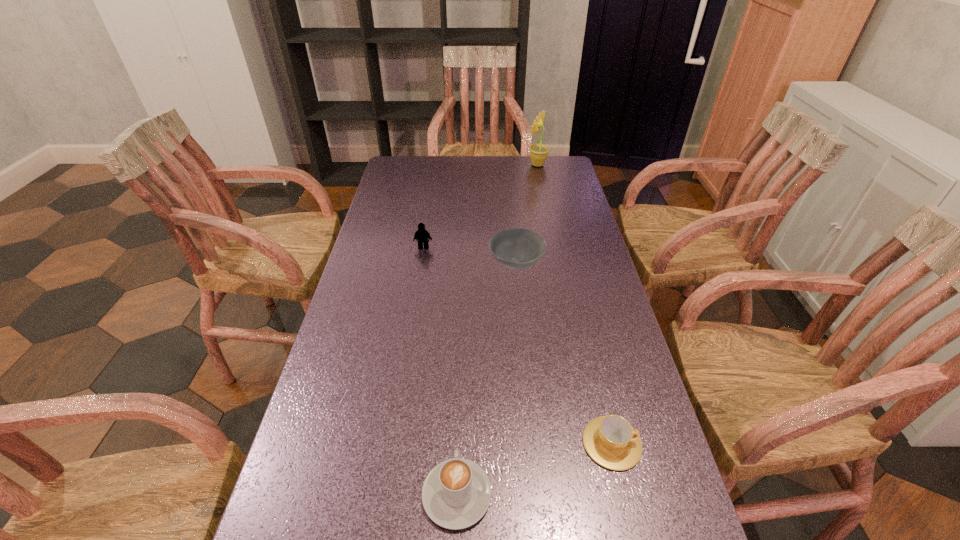
In the image, there is a desktop. Where is `vacant space at the left edge`? This screenshot has width=960, height=540. vacant space at the left edge is located at coordinates (310, 442).

Identify the location of vacant area at the right edge of the desktop. (659, 502).

Locate an element on the screen. This screenshot has height=540, width=960. free space at the far left corner of the desktop is located at coordinates (399, 171).

Locate an element on the screen. Image resolution: width=960 pixels, height=540 pixels. free space between the Lego and the farthest object is located at coordinates (481, 206).

At what (x,y) coordinates should I click in order to perform the action: click on vacant space in between the bowl and the farthest object. Please return your answer as a coordinate pair (x, y). Looking at the image, I should click on (527, 214).

Identify the location of free spot between the shortest object and the fourth object from right to left. (535, 469).

Locate an element on the screen. The height and width of the screenshot is (540, 960). vacant area that lies between the cup and the Lego is located at coordinates (517, 345).

Find the location of a particular element. Image resolution: width=960 pixels, height=540 pixels. free space between the cappuccino and the leftmost object is located at coordinates (441, 371).

Where is `free spot between the farthest object and the cappuccino`? Image resolution: width=960 pixels, height=540 pixels. free spot between the farthest object and the cappuccino is located at coordinates (497, 329).

Where is `free space between the tallest object and the fourth object from right to left`? The width and height of the screenshot is (960, 540). free space between the tallest object and the fourth object from right to left is located at coordinates (497, 329).